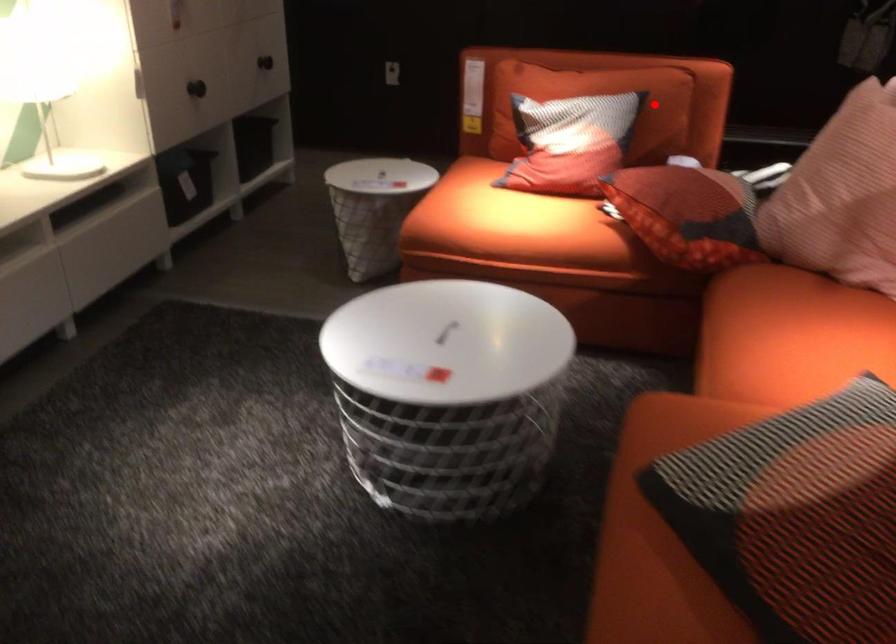
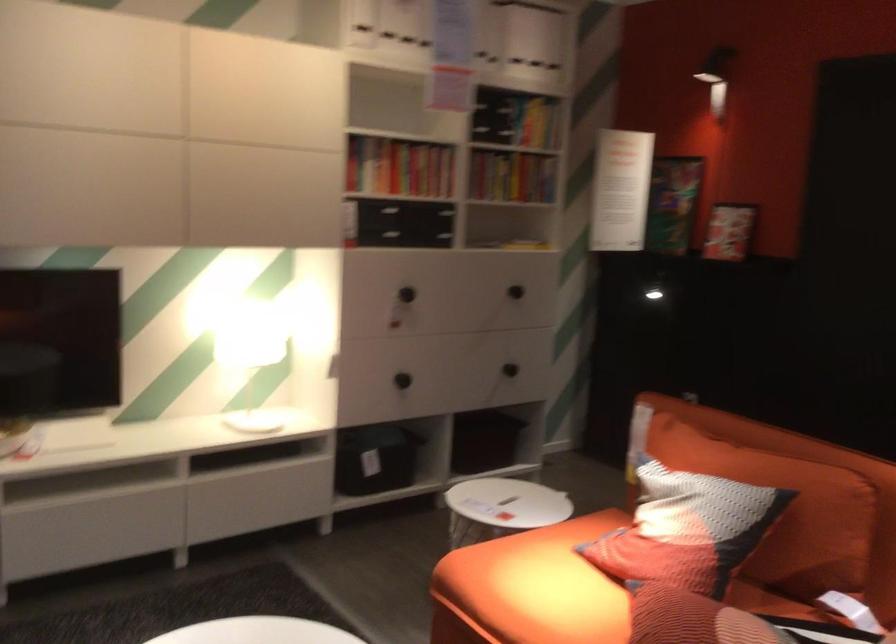
Locate, in the second image, the point that corresponds to the highlighted location in the first image.

(785, 511)